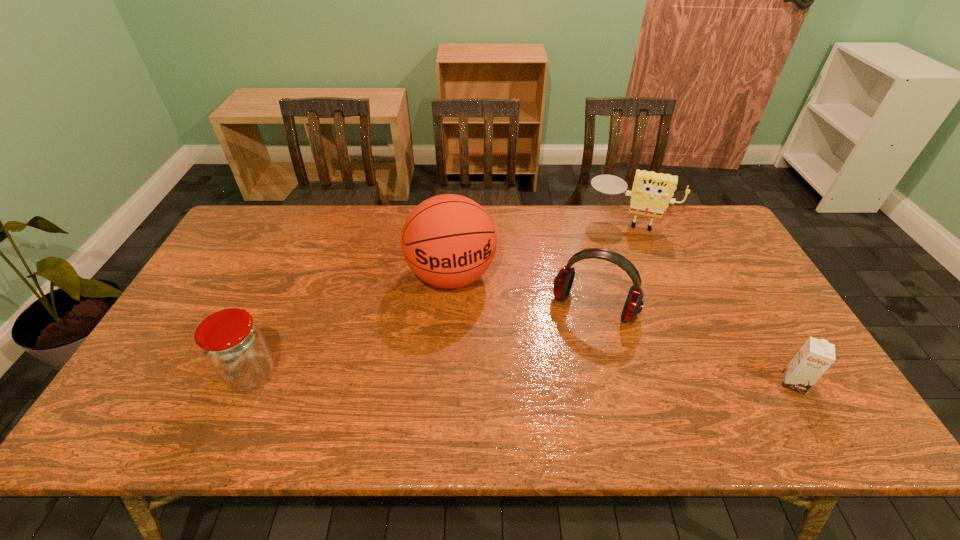
This screenshot has height=540, width=960. I want to click on jar located at the near edge, so click(x=233, y=345).

Identify the location of chocolate milk located at the near edge. (816, 356).

At what (x,y) coordinates should I click in order to perform the action: click on object at the right edge. Please return your answer as a coordinate pair (x, y). This screenshot has height=540, width=960. Looking at the image, I should click on (816, 356).

Identify the location of object positioned at the near right corner. (816, 356).

Where is `free space at the far edge`? The image size is (960, 540). free space at the far edge is located at coordinates (498, 212).

Identify the location of vacant space at the near edge of the desktop. Image resolution: width=960 pixels, height=540 pixels. (571, 377).

In the image, there is a desktop. Where is `free space at the left edge`? free space at the left edge is located at coordinates (237, 307).

Identify the location of free location at the far left corner. The image size is (960, 540). (270, 228).

I want to click on free region at the far right corner, so click(710, 222).

You are a GUI agent. You are given a task and a screenshot of the screen. Output one action in this format:
    pyautogui.click(x=<x>, y=<y>)
    Task: Click on the empty space between the earphone and the farthest object
    The width and height of the screenshot is (960, 540).
    Given the screenshot: What is the action you would take?
    (x=611, y=263)